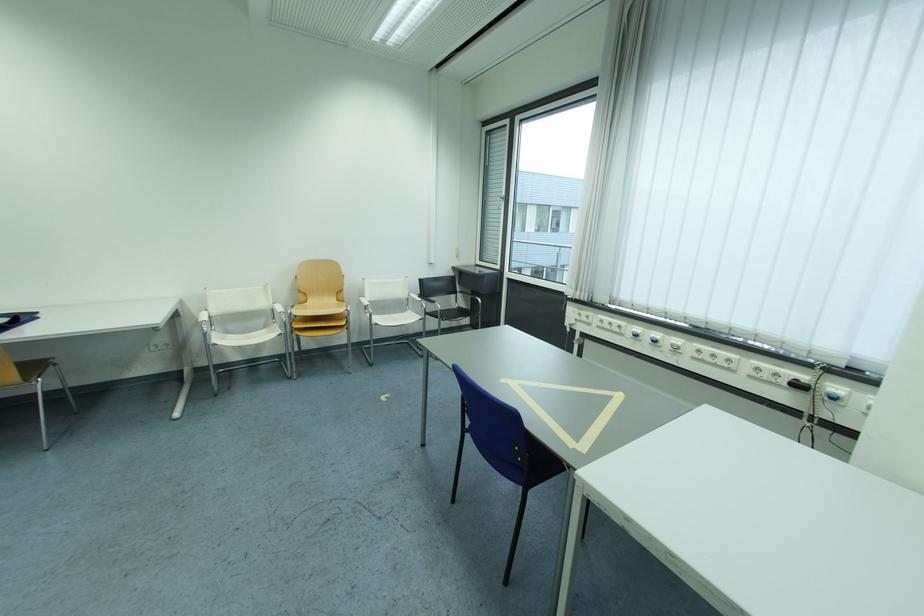
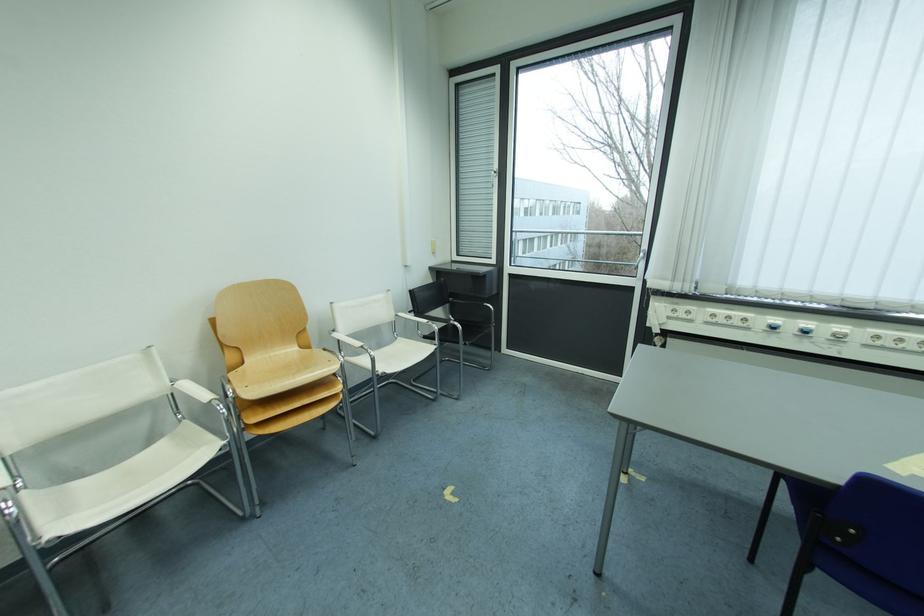
Find the pixel in the second image that matches pixel 665 336 in the first image.

(816, 326)